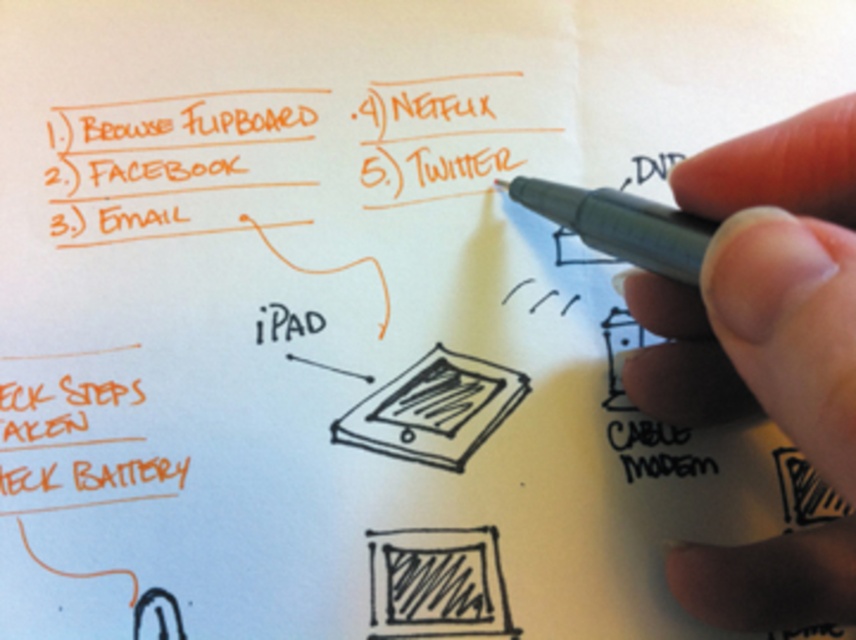
From the picture: You are organizing a stationery drawer and see the skinny pen at upper right and the black pen at upper right. Which pen takes up more space in the drawer?

The skinny pen at upper right is bigger than the black pen at upper right, so it takes up more space in the drawer.

You are organizing a stationery drawer and see the skinny pen at upper right and the black pen at upper right. Which pen is positioned lower in the drawer?

The skinny pen at upper right is positioned lower than the black pen at upper right in the drawer.

You are a student trying to write on the sketchy paper tablet at center. Can you easily access the black pen at upper right without moving the paper?

The black pen at upper right is behind the sketchy paper tablet at center, so you cannot easily access it without moving the paper first.